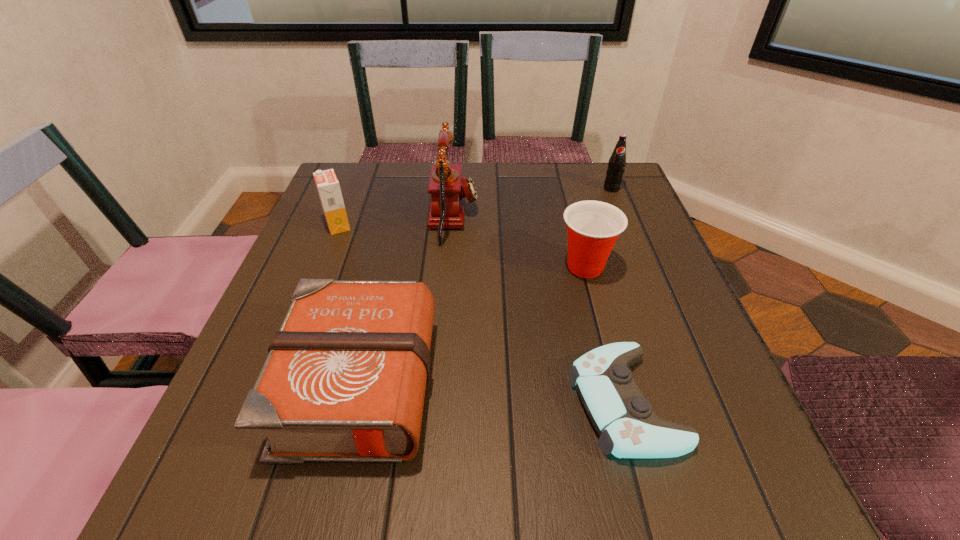
Locate an element on the screen. vacant area located 0.160m on the right of the Bible is located at coordinates (531, 380).

Identify the location of vacant space located on the back of the shortest object. (597, 298).

Where is `telephone located in the far edge section of the desktop`? telephone located in the far edge section of the desktop is located at coordinates [x=447, y=205].

The image size is (960, 540). I want to click on pop that is positioned at the far edge, so click(616, 166).

The width and height of the screenshot is (960, 540). What are the coordinates of `Bible that is at the near edge` in the screenshot? It's located at (344, 380).

At what (x,y) coordinates should I click in order to perform the action: click on control at the near edge. Please return your answer as a coordinate pair (x, y). Image resolution: width=960 pixels, height=540 pixels. Looking at the image, I should click on (628, 428).

The width and height of the screenshot is (960, 540). Find the location of `orange juice that is at the left edge`. orange juice that is at the left edge is located at coordinates (328, 187).

Find the location of a particular element. This screenshot has width=960, height=540. Bible that is at the left edge is located at coordinates (344, 380).

The image size is (960, 540). Find the location of `pop that is at the right edge`. pop that is at the right edge is located at coordinates (616, 166).

Identify the location of cup positioned at the right edge. (593, 227).